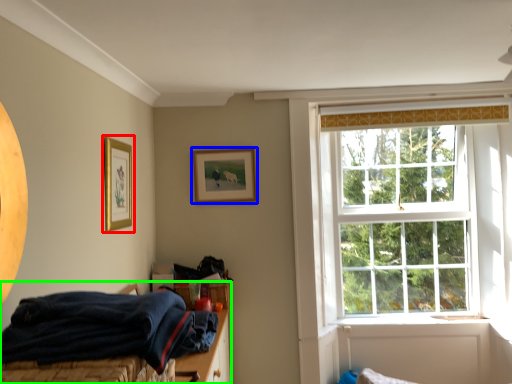
Question: Which object is positioned farthest from picture frame (highlighted by a red box)? Select from picture frame (highlighted by a blue box) and bed (highlighted by a green box).

Choices:
 (A) picture frame
 (B) bed

Answer: (B)